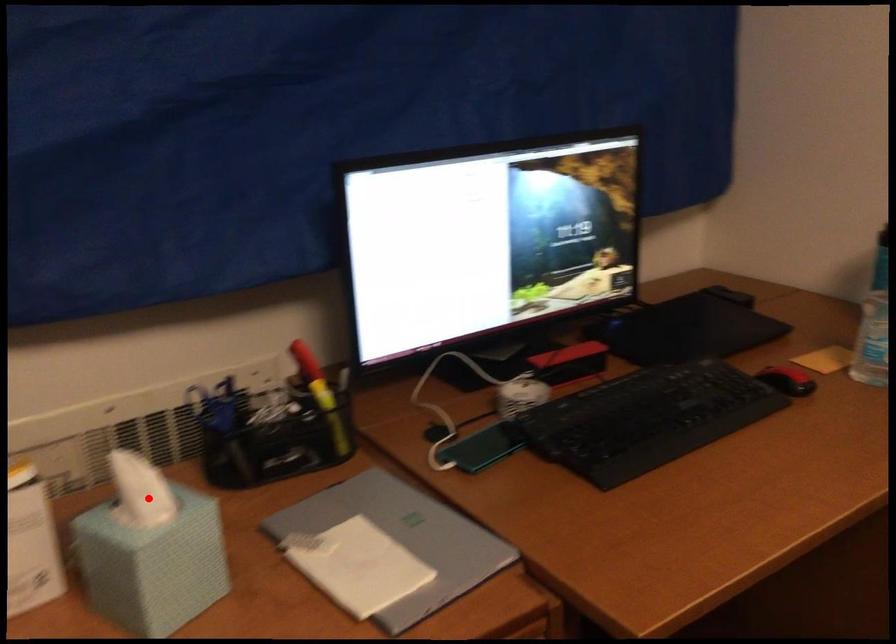
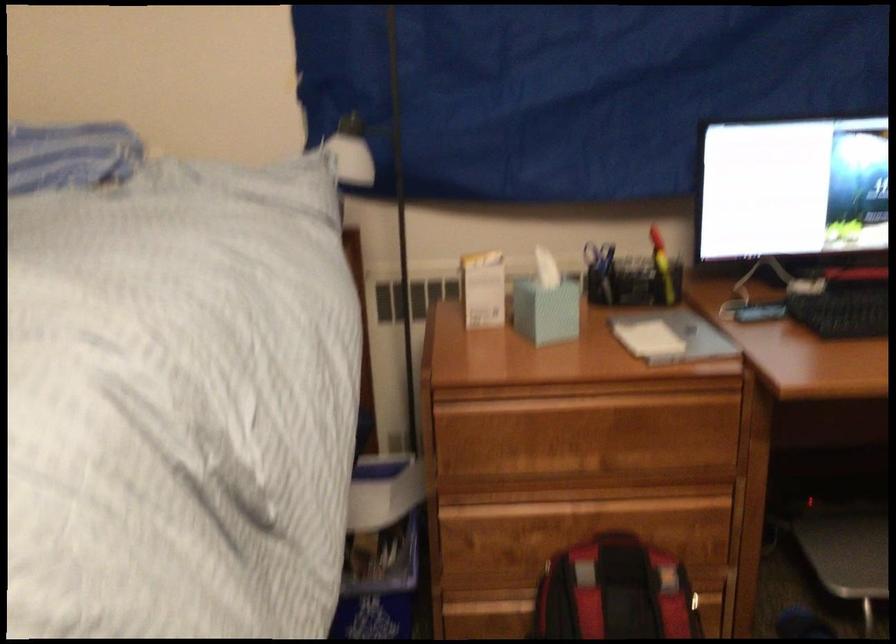
Question: I am providing you with two images of the same scene from different viewpoints. A red point is shown in image1. For the corresponding object point in image2, is it positioned nearer or farther from the camera?

Choices:
 (A) Nearer
 (B) Farther

Answer: (B)